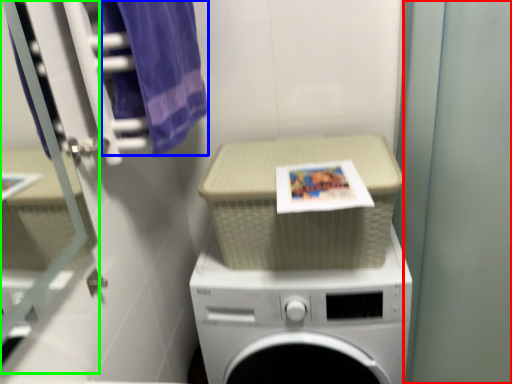
Question: Which object is positioned closest to screen door (highlighted by a red box)? Select from bath towel (highlighted by a blue box) and glass door (highlighted by a green box).

Choices:
 (A) bath towel
 (B) glass door

Answer: (A)